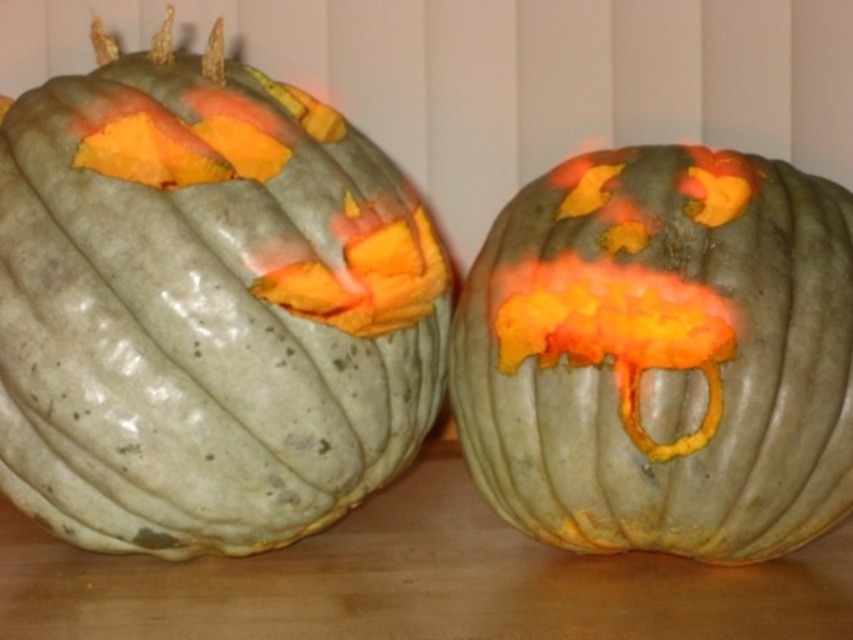
Describe the element at coordinates (206, 305) in the screenshot. I see `matte green pumpkin at left` at that location.

Does point (76, 449) lie behind point (839, 278)?

No, (76, 449) is closer to viewer.

Measure the distance between matte green pumpkin at left and camera.

A distance of 1.00 meters exists between matte green pumpkin at left and camera.

Identify the location of matte green pumpkin at left. (206, 305).